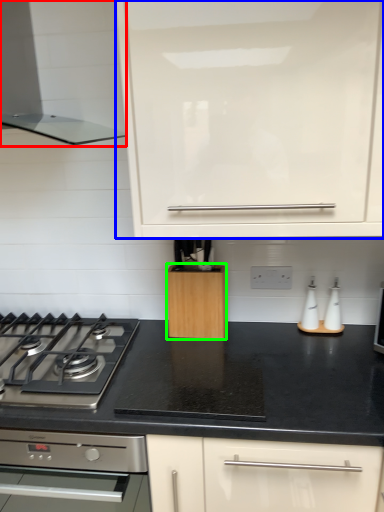
Question: Which object is positioned closest to home appliance (highlighted by a red box)? Select from cabinetry (highlighted by a blue box) and kitchen appliance (highlighted by a green box).

Choices:
 (A) cabinetry
 (B) kitchen appliance

Answer: (A)